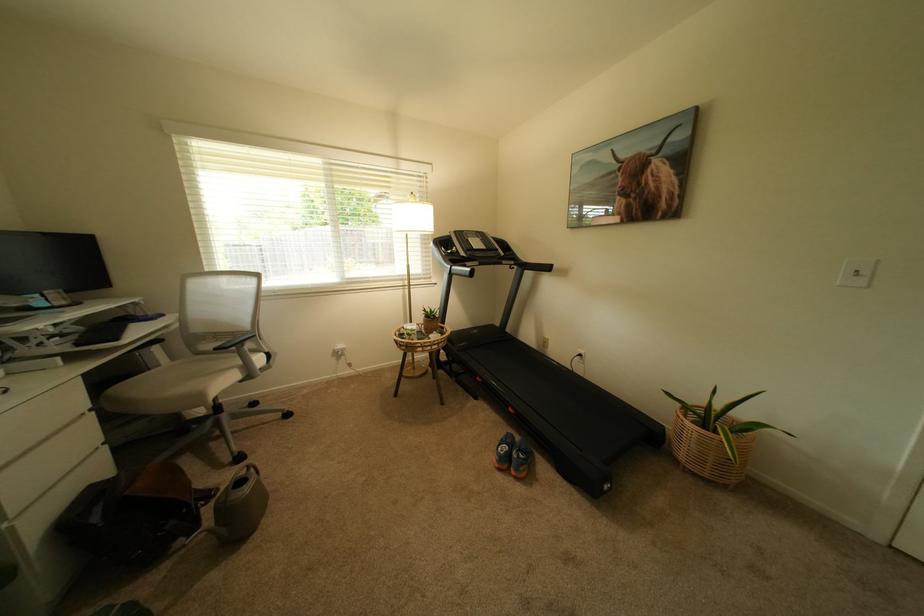
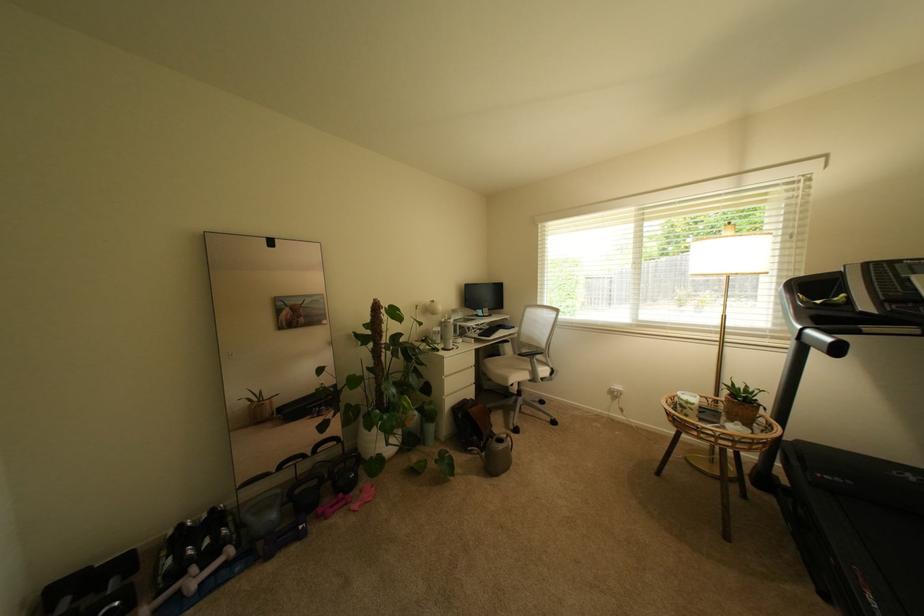
In the second image, find the point that corresponds to pixel 249 363 in the first image.

(540, 370)